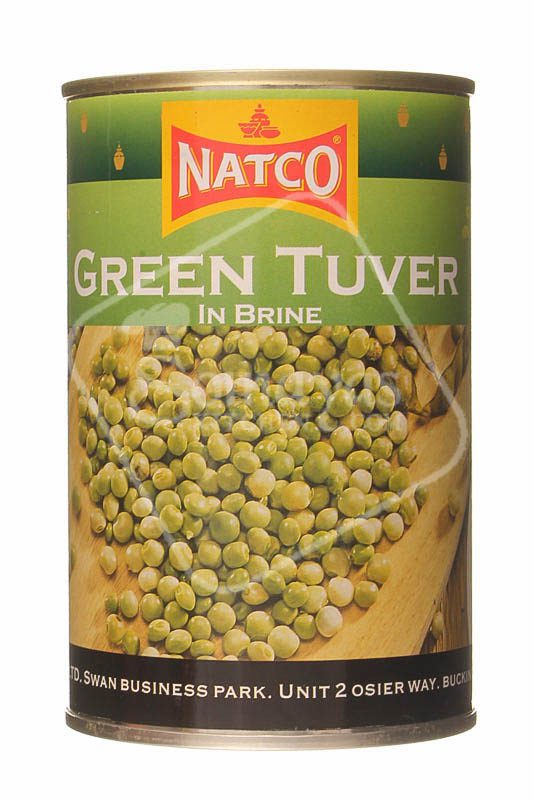
You are a GUI agent. You are given a task and a screenshot of the screen. Output one action in this format:
    pyautogui.click(x=<x>, y=<y>)
    Task: Click on the single sweet pea on edge of cutting board
    The image size is (533, 800).
    Given the screenshot: What is the action you would take?
    pyautogui.click(x=439, y=628)